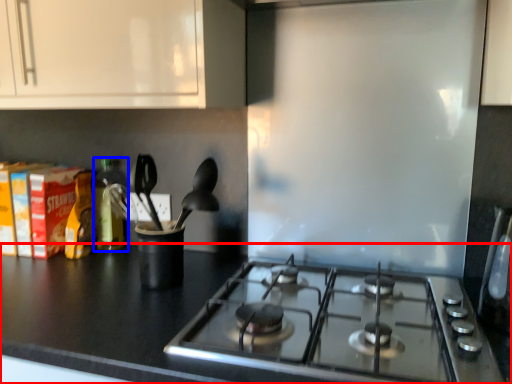
Question: Which point is closer to the camera, countertop (highlighted by a red box) or bottle (highlighted by a blue box)?

Choices:
 (A) countertop
 (B) bottle

Answer: (A)